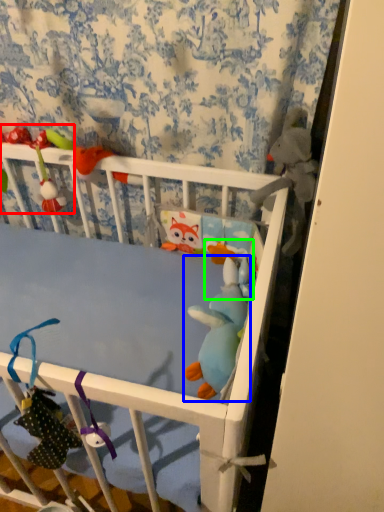
Question: Which is nearer to the toy (highlighted by a red box)? toy (highlighted by a blue box) or toy (highlighted by a green box).

Choices:
 (A) toy
 (B) toy

Answer: (B)